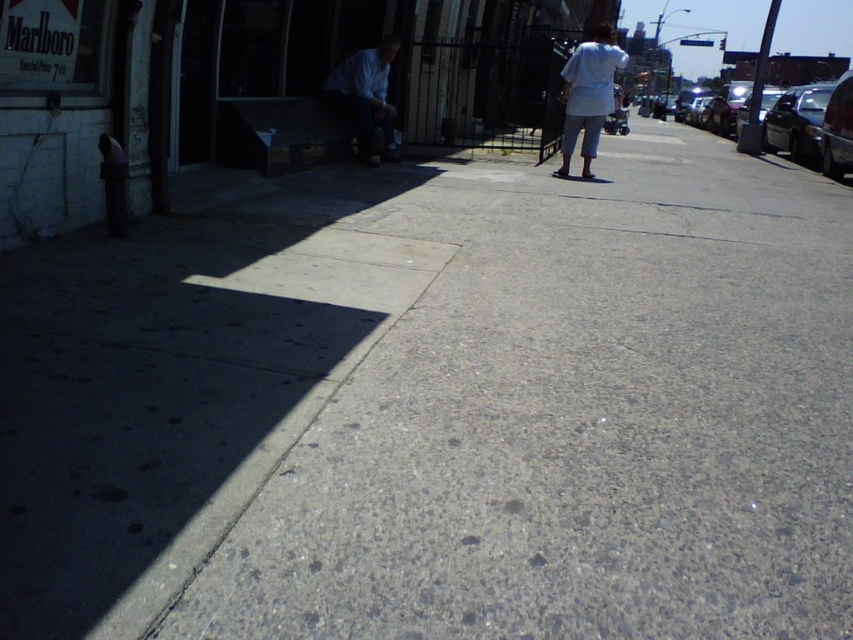
Looking at this image, you are standing on the sidewalk in front of the tobacco shop and see two points marked on the ground. The first point is at coordinates point(825, 100) and the second is at point(822, 163). Which point is closer to you?

Point(825, 100) is further to the camera than point(822, 163), so the second point is closer to you.

You are a delivery person trying to decide which vehicle to load a tall package into. You see the shiny black sedan at right and the metallic silver van at right. Which vehicle has more vertical space in its cargo area?

The shiny black sedan at right has a greater height compared to the metallic silver van at right, so it has more vertical space in its cargo area.